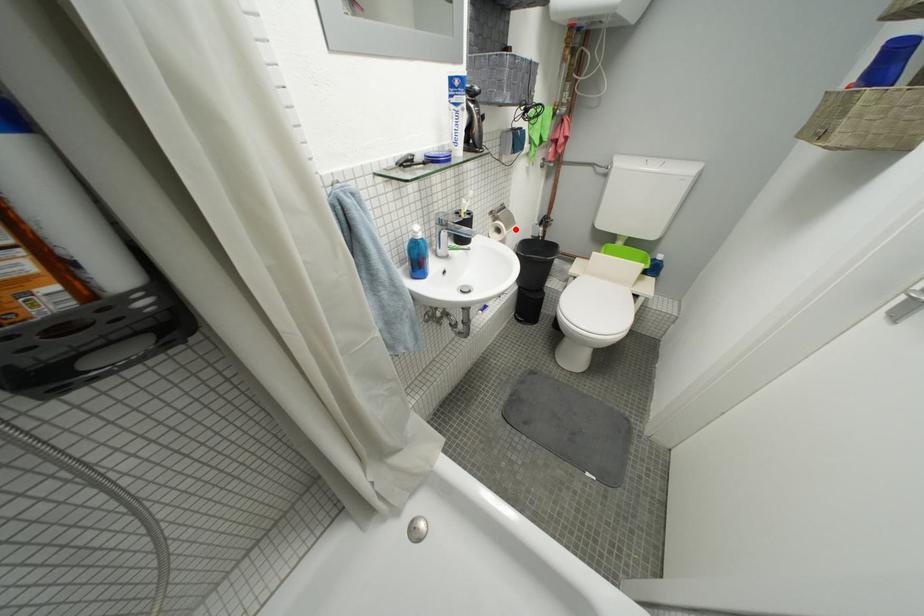
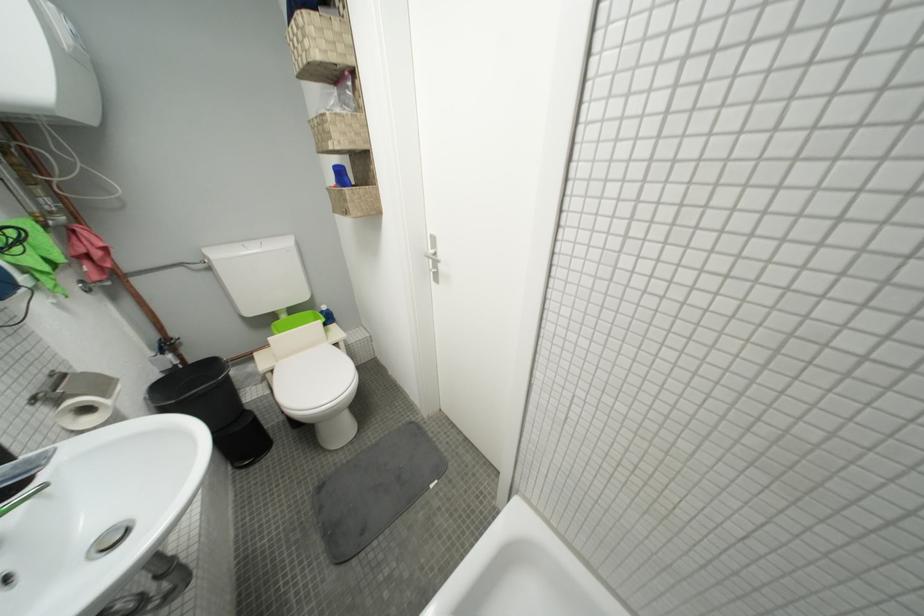
Locate, in the second image, the point that corresponds to the highlighted location in the first image.

(113, 397)